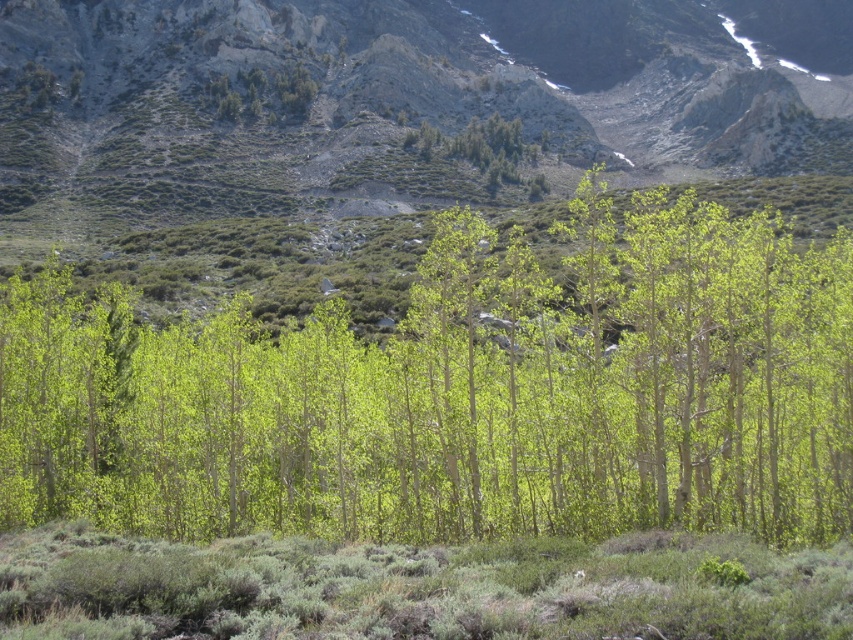
You are standing at the center of the image and want to walk towards the green leafy trees at center. Which direction should you face to move directly towards them?

Since the green leafy trees at center are located at point coordinates, you should face directly forward as they are already centered in your view.

In the scene shown: You are an environmental scientist studying the grove. You observe the green leafy trees at center and the green leafy tree at upper center. Which of these two trees is located to the right of the other?

The green leafy trees at center is positioned on the right side of green leafy tree at upper center.

You are standing at the origin point in the image. Which direction should you move to reach the green matte trees at center?

The green matte trees at center are located at coordinates 0.616 on the x axis and 0.539 on the y axis. Since you are at the origin point, you should move towards the right and slightly upwards to reach them.